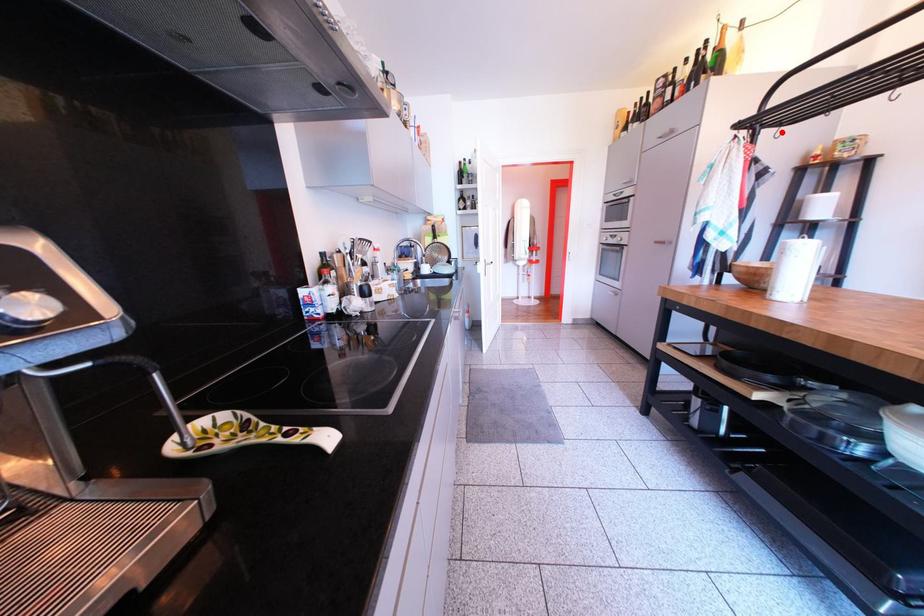
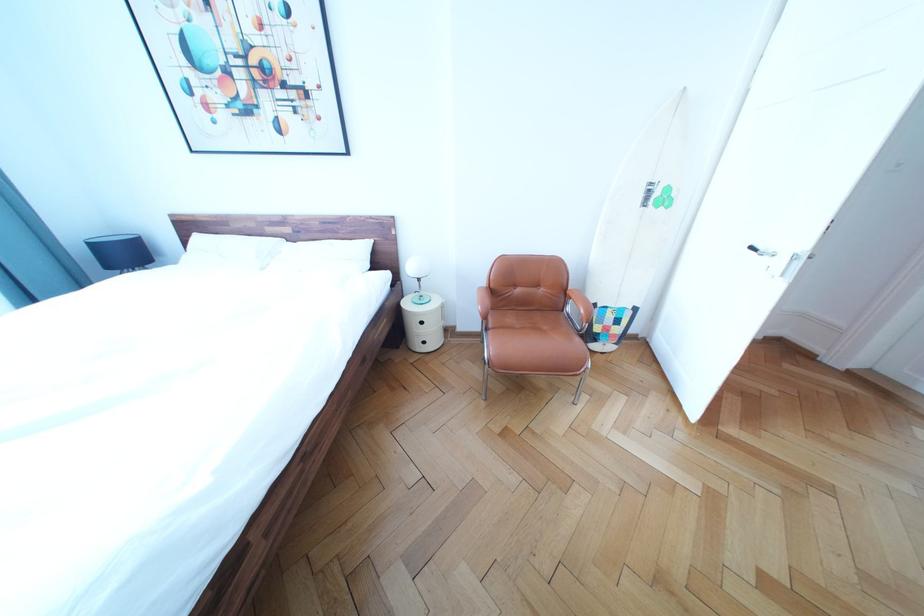
Question: I am providing you with two images of the same scene from different viewpoints. A red point is marked on the first image. Can you still see the location of the red point in image 2?

Choices:
 (A) Yes
 (B) No

Answer: (B)